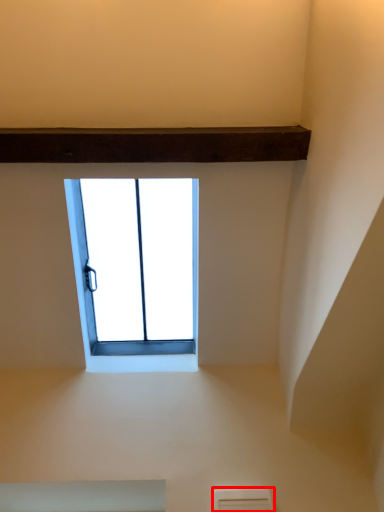
Question: From the image's perspective, where is air conditioning (annotated by the red box) located in relation to window in the image?

Choices:
 (A) above
 (B) below

Answer: (B)